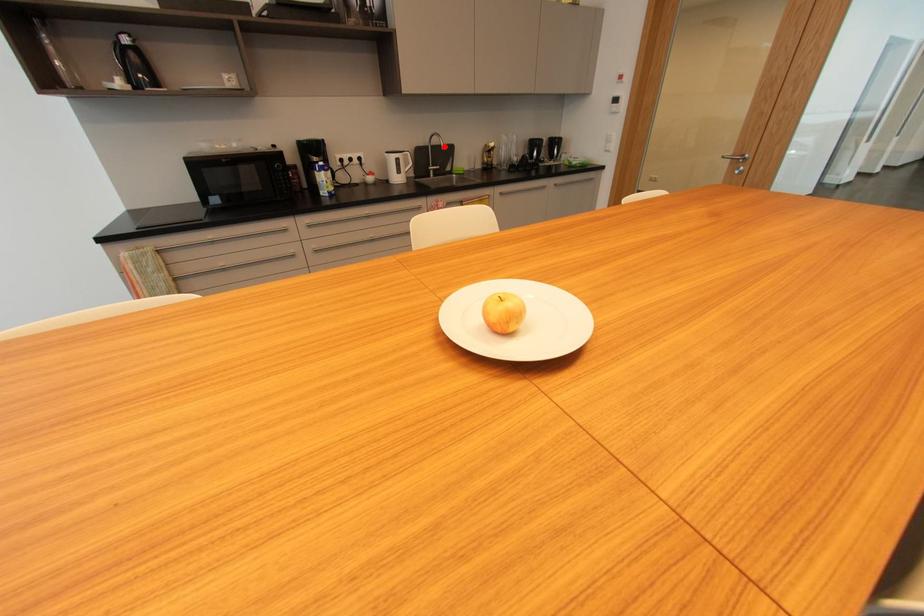
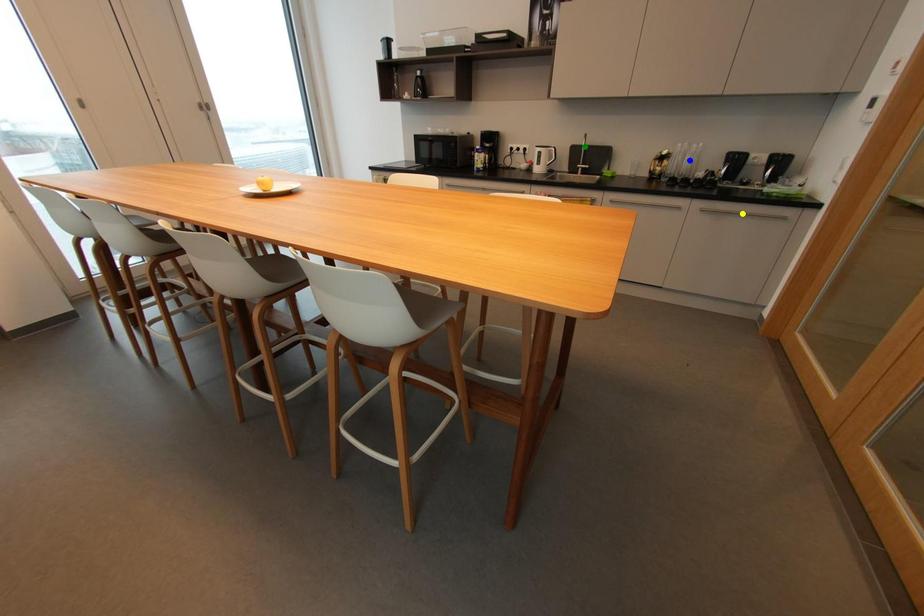
Question: I am providing you with two images of the same scene from different viewpoints. A red point is marked on the first image. You are given multiple points on the second image. In image 2, which mark is for the same physical point as the one in image 1?

Choices:
 (A) yellow point
 (B) blue point
 (C) green point

Answer: (C)